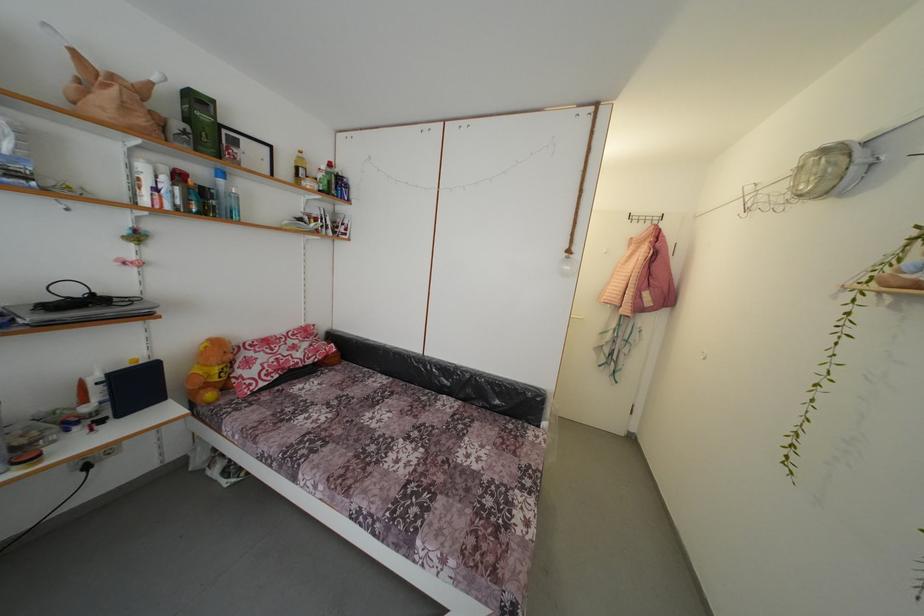
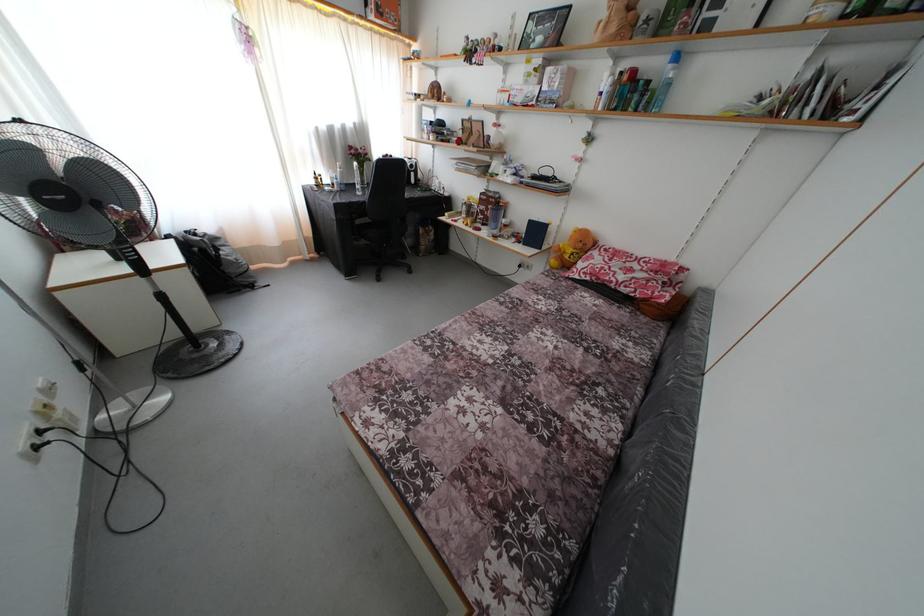
The point at (375, 377) is marked in the first image. Where is the corresponding point in the second image?

(663, 353)